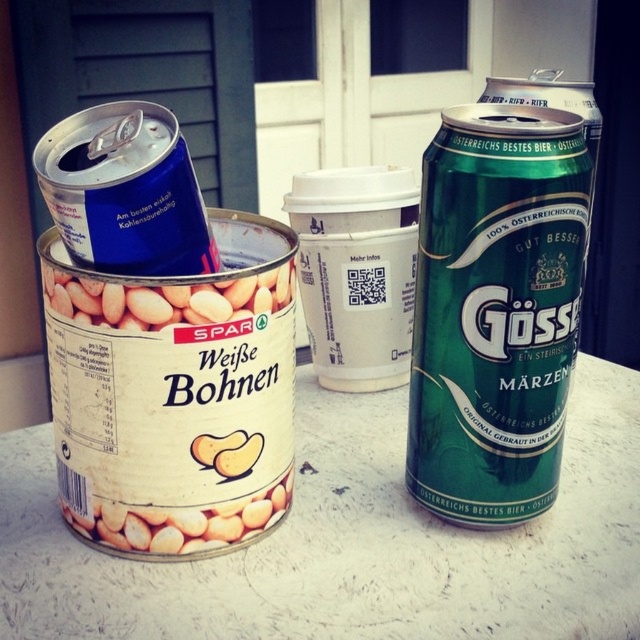
Question: Among these objects, which one is nearest to the camera?

Choices:
 (A) blue metallic can at upper left
 (B) green metallic beer can at right
 (C) white matte beans can at center

Answer: (A)

Question: Which point is farther to the camera?

Choices:
 (A) blue metallic can at upper left
 (B) white matte beans can at center

Answer: (B)

Question: In this image, where is green metallic beer can at right located relative to white matte beans can at center?

Choices:
 (A) below
 (B) above

Answer: (A)

Question: Based on their relative distances, which object is farther from the white matte beans can at center?

Choices:
 (A) blue metallic can at upper left
 (B) green metallic beer can at right

Answer: (B)

Question: Can you confirm if blue metallic can at upper left is wider than white matte beans can at center?

Choices:
 (A) yes
 (B) no

Answer: (B)

Question: Does blue metallic can at upper left have a lesser width compared to white matte beans can at center?

Choices:
 (A) no
 (B) yes

Answer: (B)